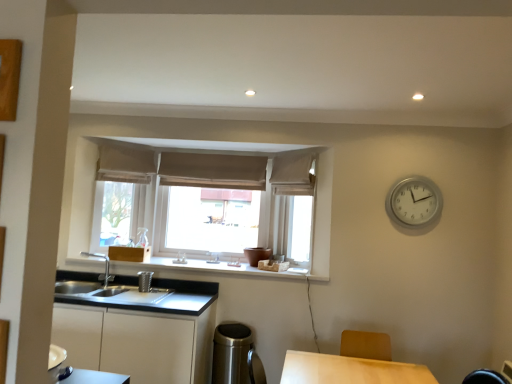
Question: Is white matte cabinet at lower left at the left side of white matte window sill at center?

Choices:
 (A) yes
 (B) no

Answer: (A)

Question: Is white matte cabinet at lower left aimed at white matte window sill at center?

Choices:
 (A) yes
 (B) no

Answer: (B)

Question: From the image's perspective, is white matte cabinet at lower left located above white matte window sill at center?

Choices:
 (A) yes
 (B) no

Answer: (B)

Question: Is white matte cabinet at lower left positioned in front of white matte window sill at center?

Choices:
 (A) no
 (B) yes

Answer: (B)

Question: Is white matte cabinet at lower left smaller than white matte window sill at center?

Choices:
 (A) yes
 (B) no

Answer: (B)

Question: From their relative heights in the image, would you say white fabric curtain at upper center, the first curtain viewed from the right, is taller or shorter than polished stainless steel trash can at lower center?

Choices:
 (A) short
 (B) tall

Answer: (A)

Question: From the image's perspective, is white fabric curtain at upper center, which appears as the 3th curtain when viewed from the left, positioned above or below polished stainless steel trash can at lower center?

Choices:
 (A) above
 (B) below

Answer: (A)

Question: Considering the positions of white fabric curtain at upper center, the first curtain viewed from the right, and polished stainless steel trash can at lower center in the image, is white fabric curtain at upper center, the first curtain viewed from the right, wider or thinner than polished stainless steel trash can at lower center?

Choices:
 (A) wide
 (B) thin

Answer: (B)

Question: Looking at the image, does white fabric curtain at upper center, the first curtain viewed from the right, seem bigger or smaller compared to polished stainless steel trash can at lower center?

Choices:
 (A) big
 (B) small

Answer: (B)

Question: Based on their sizes in the image, would you say brown fabric curtain at center, marked as the 2th curtain in a right-to-left arrangement, is bigger or smaller than white matte window sill at center?

Choices:
 (A) big
 (B) small

Answer: (B)

Question: Considering the relative positions of brown fabric curtain at center, acting as the second curtain starting from the left, and white matte window sill at center in the image provided, is brown fabric curtain at center, acting as the second curtain starting from the left, to the left or to the right of white matte window sill at center?

Choices:
 (A) right
 (B) left

Answer: (A)

Question: Considering the positions of brown fabric curtain at center, acting as the second curtain starting from the left, and white matte window sill at center in the image, is brown fabric curtain at center, acting as the second curtain starting from the left, taller or shorter than white matte window sill at center?

Choices:
 (A) short
 (B) tall

Answer: (B)

Question: Considering the positions of point (261, 165) and point (69, 259), is point (261, 165) closer or farther from the camera than point (69, 259)?

Choices:
 (A) farther
 (B) closer

Answer: (A)

Question: Looking at the image, does white fabric curtain at upper center, the first curtain viewed from the right, seem bigger or smaller compared to white matte cabinet at lower left?

Choices:
 (A) small
 (B) big

Answer: (A)

Question: Is point (287, 190) positioned closer to the camera than point (173, 380)?

Choices:
 (A) farther
 (B) closer

Answer: (A)